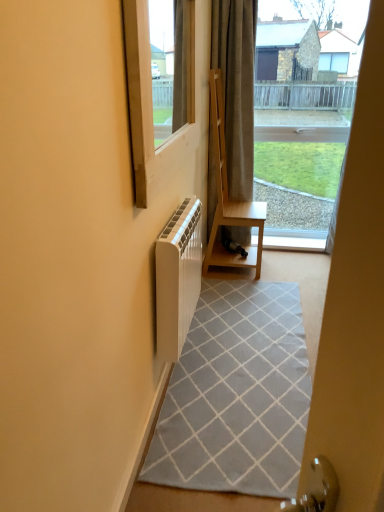
Question: From the image's perspective, is white wood at center located above or below white plastic window at upper left?

Choices:
 (A) above
 (B) below

Answer: (B)

Question: Considering the positions of white wood at center and white plastic window at upper left in the image, is white wood at center taller or shorter than white plastic window at upper left?

Choices:
 (A) tall
 (B) short

Answer: (B)

Question: Which of these objects is positioned closest to the white plastic window at upper left?

Choices:
 (A) light brown wood shelf at center
 (B) dark gray textured curtain at center
 (C) white matte radiator at left
 (D) white wood at center
 (E) gray woven rug at center

Answer: (C)

Question: Considering the real-world distances, which object is closest to the gray woven rug at center?

Choices:
 (A) dark gray textured curtain at center
 (B) white wood at center
 (C) white matte radiator at left
 (D) white plastic window at upper left
 (E) transparent glass window at center

Answer: (C)